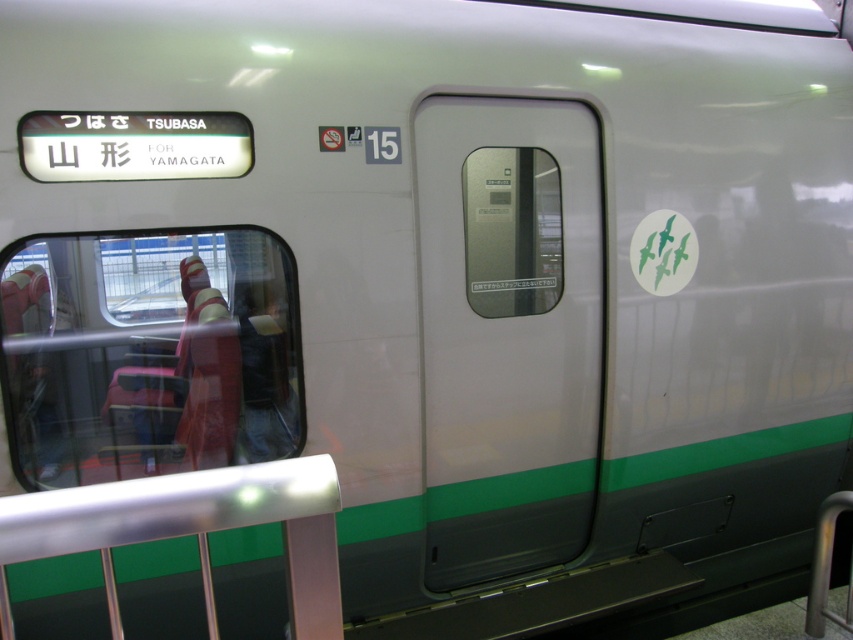
Looking at this image, you are a maintenance worker standing 1.5 meters away from the matte white door at center. You need to reach a digital display panel located above the door. The display panel is 2.5 meters tall. Can you reach it without any tools?

The matte white door at center is 2.68 meters from the camera. Since you are standing 1.5 meters away from the door, the total distance to the display panel would be 2.68 meters plus 1.5 meters, totaling 4.18 meters. The display panel is 2.5 meters tall, so unless you have a ladder or some equipment to reach that height, you cannot reach it without tools.

You are standing next to the train and want to take a photo of the metallic silver rail at lower left. If your camera can focus on objects within 4 feet, will it be able to capture the rail clearly?

The metallic silver rail at lower left is 3.96 feet away from the camera, which is within the 4 feet focusing range, so yes, the camera can capture it clearly.

You are standing 2 meters away from the train. A maintenance worker needs to reach a specific point on the train located at coordinates point (550, 532). If the worker can extend their arm 1.2 meters, can they reach that point without moving closer?

The point (550, 532) is 3.12 meters away from the viewer. Since the worker is already 2 meters away and can extend their arm 1.2 meters, the total reach is 3.2 meters. The distance to the point is 3.12 meters, so the worker can just barely reach it.